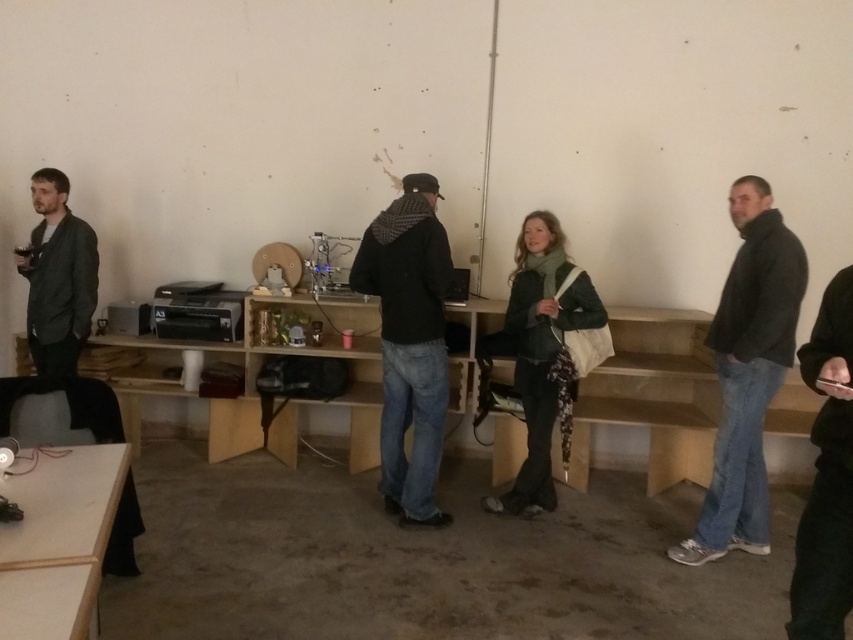
Who is lower down, black fabric phone at lower right or light brown wooden table at lower left?

light brown wooden table at lower left is lower down.

Locate an element on the screen. This screenshot has width=853, height=640. black fabric phone at lower right is located at coordinates (827, 476).

Image resolution: width=853 pixels, height=640 pixels. What do you see at coordinates (827, 476) in the screenshot? I see `black fabric phone at lower right` at bounding box center [827, 476].

Find the location of a particular element. The width and height of the screenshot is (853, 640). black fabric phone at lower right is located at coordinates (827, 476).

Does point (395, 400) come in front of point (3, 538)?

No, it is behind (3, 538).

Is black matte jacket at center thinner than light brown wooden table at lower left?

Yes.

Where is `black matte jacket at center`? black matte jacket at center is located at coordinates (409, 342).

Does point (740, 509) lie in front of point (387, 484)?

Yes, it is in front of point (387, 484).

Does dark gray jacket at center have a lesser height compared to black matte jacket at center?

In fact, dark gray jacket at center may be taller than black matte jacket at center.

You are a GUI agent. You are given a task and a screenshot of the screen. Output one action in this format:
    pyautogui.click(x=<x>, y=<y>)
    Task: Click on the dark gray jacket at center
    
    Given the screenshot: What is the action you would take?
    pyautogui.click(x=747, y=372)

Find the location of a particular element. The image size is (853, 640). dark gray jacket at center is located at coordinates (747, 372).